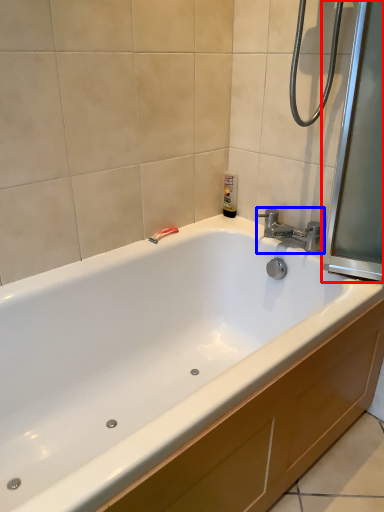
Question: Which of the following is the closest to the observer, screen door (highlighted by a red box) or tap (highlighted by a blue box)?

Choices:
 (A) screen door
 (B) tap

Answer: (A)